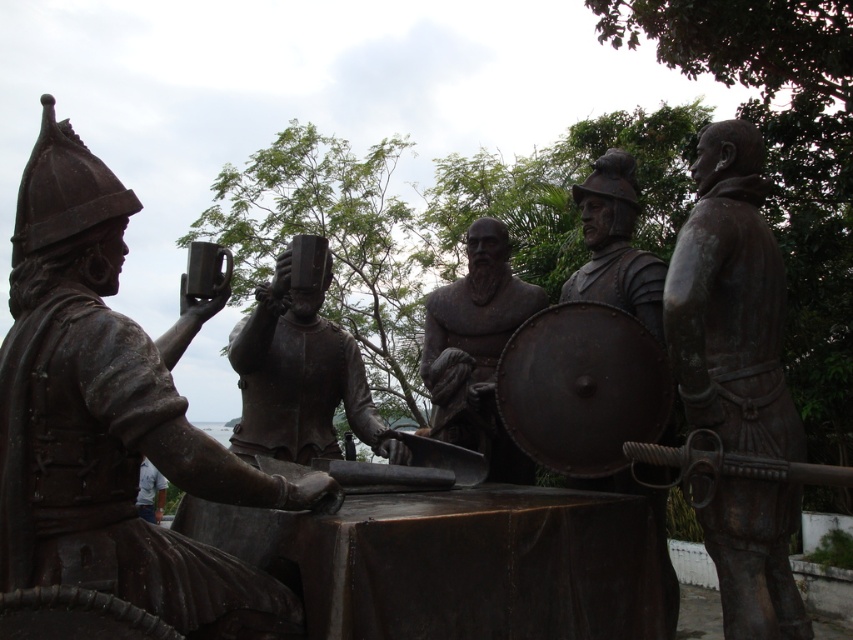
You are standing at the base of the bronze statue group. There are two points marked on the ground near the statues. One is at coordinates point (717, 547) and the other at point (379, 436). Which point is closer to you?

Point (717, 547) is in front of point (379, 436), so the point closer to you is point (717, 547).

Based on the scene description, which object is shorter between the bronze helmet at center and the bronze shield at center?

The bronze helmet at center is shorter than the bronze shield at center.